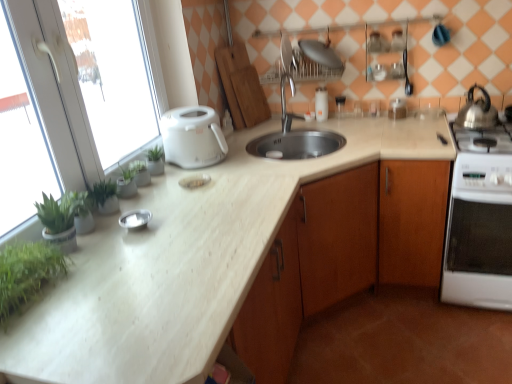
Find the location of a particular element. The height and width of the screenshot is (384, 512). free area in between green leafy plant at left and clear glass jar at upper right, the third appliance from the front is located at coordinates (248, 183).